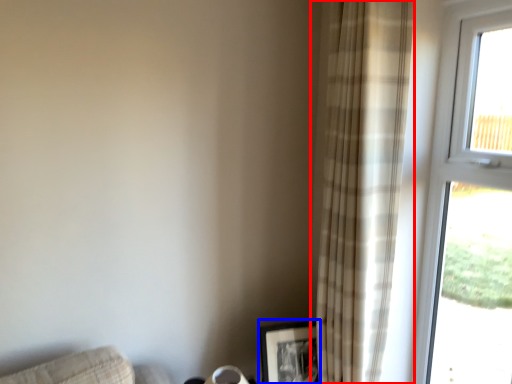
Question: Which object appears farthest to the camera in this image, curtain (highlighted by a red box) or picture frame (highlighted by a blue box)?

Choices:
 (A) curtain
 (B) picture frame

Answer: (B)